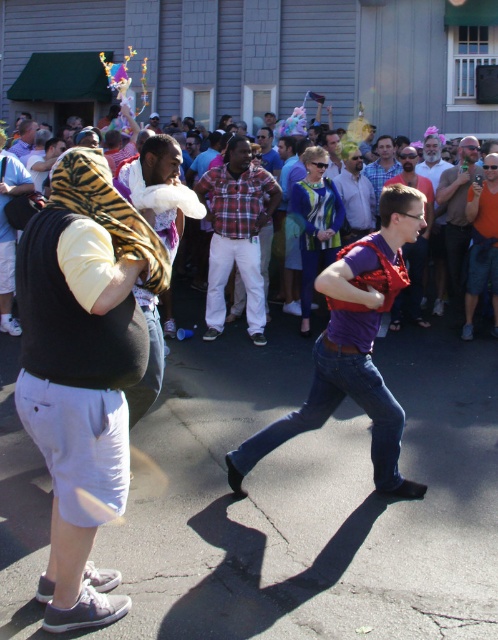
Is point (133, 368) positioned in front of point (478, 200)?

Yes, point (133, 368) is closer to viewer.

Which is above, tiger-print scarf at left or orange t-shirt at right?

orange t-shirt at right

Measure the distance between tiger-print scarf at left and camera.

tiger-print scarf at left is 3.03 meters from camera.

Find the location of a particular element. This screenshot has height=640, width=498. tiger-print scarf at left is located at coordinates (83, 369).

Is tiger-print scarf at left closer to the viewer compared to matte purple shirt at center?

Yes, it is.

Is tiger-print scarf at left above matte purple shirt at center?

No, tiger-print scarf at left is not above matte purple shirt at center.

Find the location of a particular element. The height and width of the screenshot is (640, 498). tiger-print scarf at left is located at coordinates (83, 369).

Find the location of a particular element. Image resolution: width=498 pixels, height=640 pixels. tiger-print scarf at left is located at coordinates (83, 369).

Can you confirm if matte black shirt at center is taller than matte purple shirt at center?

No.

Locate an element on the screen. This screenshot has height=640, width=498. matte black shirt at center is located at coordinates (458, 212).